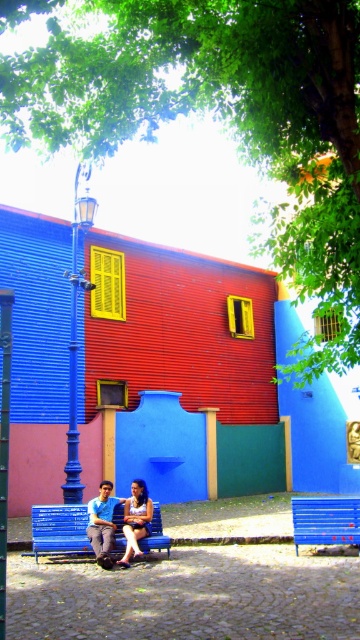
Question: Can you confirm if green leafy tree at upper center is smaller than blue painted bench at center?

Choices:
 (A) no
 (B) yes

Answer: (B)

Question: Considering the real-world distances, which object is farthest from the blue denim jeans at center?

Choices:
 (A) matte blue dress at center
 (B) blue painted bench at center

Answer: (B)

Question: Estimate the real-world distances between objects in this image. Which object is closer to the blue polished metal streetlamp at upper left?

Choices:
 (A) blue denim jeans at center
 (B) green leafy tree at upper center

Answer: (A)

Question: Does green leafy tree at upper center appear on the right side of blue denim jeans at center?

Choices:
 (A) yes
 (B) no

Answer: (B)

Question: Does brushed metal pole at left appear on the right side of blue denim jeans at center?

Choices:
 (A) no
 (B) yes

Answer: (A)

Question: Which of the following is the farthest from the observer?

Choices:
 (A) (x=117, y=538)
 (B) (x=185, y=29)
 (C) (x=3, y=417)

Answer: (A)